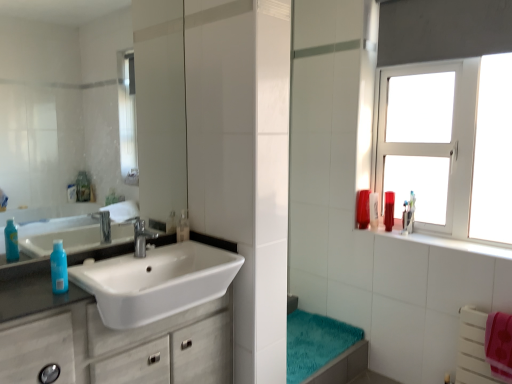
This screenshot has height=384, width=512. In order to click on vacant space to the left of silver metallic faucet at center in this screenshot , I will do `click(109, 257)`.